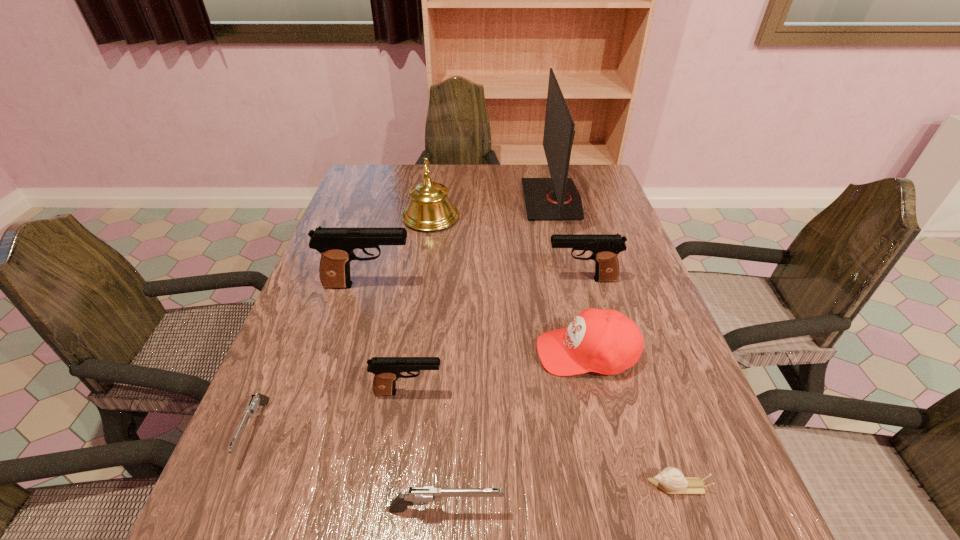
Identify the location of blank space located at the barrel of the rightmost black pistol. This screenshot has width=960, height=540. (515, 280).

The width and height of the screenshot is (960, 540). I want to click on blank area located at the barrel of the rightmost black pistol, so [475, 280].

I want to click on vacant space positioned 0.370m at the barrel of the rightmost black pistol, so click(400, 280).

Where is `free space located at the barrel of the third nearest pistol`? The height and width of the screenshot is (540, 960). free space located at the barrel of the third nearest pistol is located at coordinates (590, 393).

At what (x,y) coordinates should I click in order to perform the action: click on vacant space positioned on the front panel of the fifth farthest object. Please return your answer as a coordinate pair (x, y). Looking at the image, I should click on (400, 353).

You are a GUI agent. You are given a task and a screenshot of the screen. Output one action in this format:
    pyautogui.click(x=<x>, y=<y>)
    Task: Click on the vacant space located on the front panel of the fifth farthest object
    
    Given the screenshot: What is the action you would take?
    pyautogui.click(x=433, y=353)

Locate an element on the screen. The image size is (960, 540). vacant point located 0.310m on the front panel of the fifth farthest object is located at coordinates (391, 353).

Find the location of `vacant space located on the front-facing side of the bigger silver pistol`. vacant space located on the front-facing side of the bigger silver pistol is located at coordinates (616, 510).

Find the location of a particular element. vacant space located on the front-facing side of the fourth farthest pistol is located at coordinates (227, 496).

In order to click on free space located 0.380m on the shell of the escargot in this screenshot , I will do `click(419, 486)`.